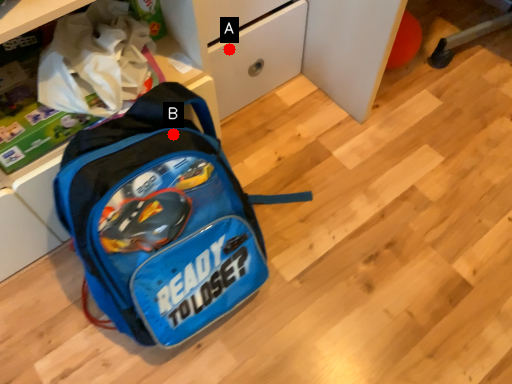
Question: Two points are circled on the image, labeled by A and B beside each circle. Which point appears farthest from the camera in this image?

Choices:
 (A) A is further
 (B) B is further

Answer: (A)